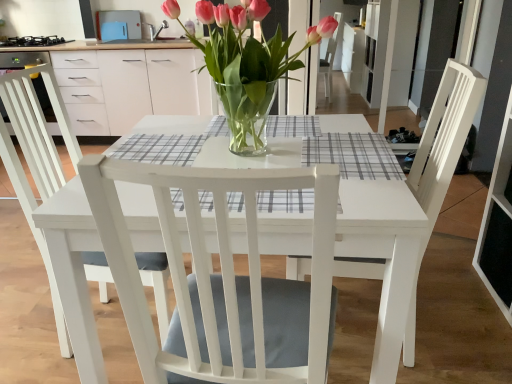
Locate an element on the screen. vacant area on top of gray checkered placemat at center, which is the first plaid in back-to-front order (from a real-world perspective) is located at coordinates (x=349, y=147).